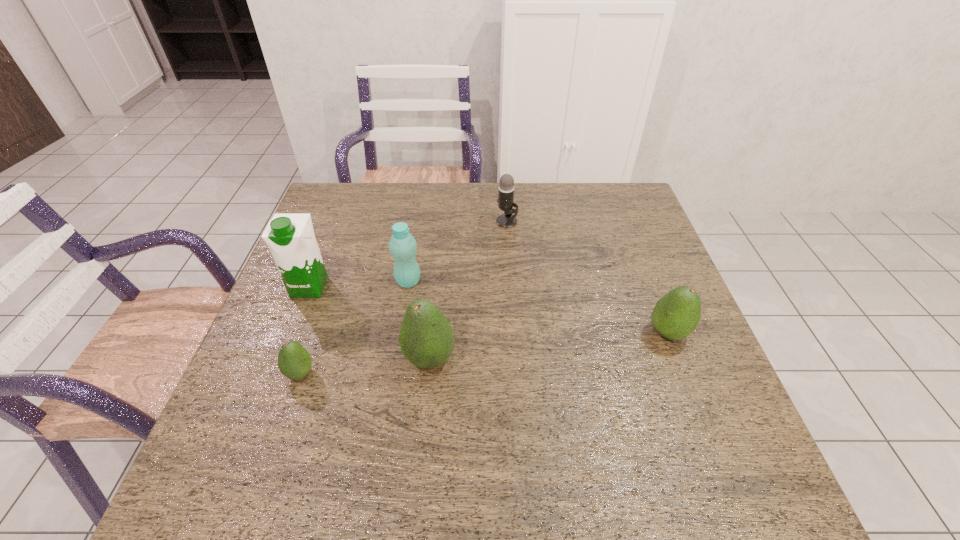
Where is `vacant space situated on the right of the second avocado from left to right`? This screenshot has width=960, height=540. vacant space situated on the right of the second avocado from left to right is located at coordinates (597, 359).

Identify the location of vacant space located on the left of the second shortest avocado. The image size is (960, 540). [x=588, y=333].

Where is `blank area located on the front of the farthest object`? The height and width of the screenshot is (540, 960). blank area located on the front of the farthest object is located at coordinates (511, 269).

Identify the location of blank space located on the left of the bottle. The height and width of the screenshot is (540, 960). (324, 281).

Locate an element on the screen. This screenshot has height=540, width=960. free space located 0.330m on the front-facing side of the tallest object is located at coordinates point(257,421).

Identify the location of object at the far edge. This screenshot has height=540, width=960. (505, 199).

Locate an element on the screen. Image resolution: width=960 pixels, height=540 pixels. avocado at the left edge is located at coordinates (294, 361).

Identify the location of soya milk that is positioned at the left edge. (290, 237).

Find the location of a particular element. object at the right edge is located at coordinates (676, 315).

This screenshot has width=960, height=540. In the image, there is a desktop. Find the location of `free space at the far edge`. free space at the far edge is located at coordinates (538, 187).